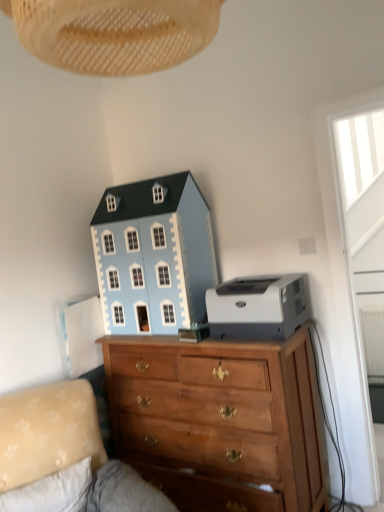
This screenshot has height=512, width=384. In order to click on velvet beige couch at lower left in this screenshot , I will do `click(64, 456)`.

Identify the location of white plastic printer at right. The width and height of the screenshot is (384, 512). (257, 307).

Describe the element at coordinates (153, 255) in the screenshot. I see `light blue painted wood dollhouse at upper center` at that location.

Locate an element on the screen. This screenshot has width=384, height=512. wooden chest of drawers at center is located at coordinates (219, 420).

Is wooden chest of drawers at center positioned far away from velvet beige couch at lower left?

No.

Between wooden chest of drawers at center and velvet beige couch at lower left, which one has less height?

Standing shorter between the two is velvet beige couch at lower left.

Considering the sizes of wooden chest of drawers at center and velvet beige couch at lower left in the image, is wooden chest of drawers at center wider or thinner than velvet beige couch at lower left?

Clearly, wooden chest of drawers at center has less width compared to velvet beige couch at lower left.

From the image's perspective, relative to velvet beige couch at lower left, is wooden chest of drawers at center above or below?

Based on their image positions, wooden chest of drawers at center is located above velvet beige couch at lower left.

Is white plastic printer at right in contact with light blue painted wood dollhouse at upper center?

No.

Does white plastic printer at right have a larger size compared to light blue painted wood dollhouse at upper center?

No.

Is white plastic printer at right in front of or behind light blue painted wood dollhouse at upper center in the image?

Visually, white plastic printer at right is located in front of light blue painted wood dollhouse at upper center.

Can you confirm if white plastic printer at right is thinner than light blue painted wood dollhouse at upper center?

In fact, white plastic printer at right might be wider than light blue painted wood dollhouse at upper center.

Does light blue painted wood dollhouse at upper center have a lesser width compared to white plastic printer at right?

Yes, light blue painted wood dollhouse at upper center is thinner than white plastic printer at right.

What's the angular difference between light blue painted wood dollhouse at upper center and white plastic printer at right's facing directions?

The facing directions of light blue painted wood dollhouse at upper center and white plastic printer at right are 0.651 degrees apart.

Does light blue painted wood dollhouse at upper center have a greater height compared to white plastic printer at right?

Indeed, light blue painted wood dollhouse at upper center has a greater height compared to white plastic printer at right.

Does point (115, 205) come closer to viewer compared to point (270, 324)?

No.

From the image's perspective, would you say light blue painted wood dollhouse at upper center is positioned over woven beige lampshade at upper center?

Incorrect, from the image's perspective, light blue painted wood dollhouse at upper center is lower than woven beige lampshade at upper center.

Considering the sizes of objects light blue painted wood dollhouse at upper center and woven beige lampshade at upper center in the image provided, who is smaller, light blue painted wood dollhouse at upper center or woven beige lampshade at upper center?

Smaller between the two is woven beige lampshade at upper center.

Consider the image. Is light blue painted wood dollhouse at upper center positioned beyond the bounds of woven beige lampshade at upper center?

Indeed, light blue painted wood dollhouse at upper center is completely outside woven beige lampshade at upper center.

Which is closer, (x=161, y=327) or (x=52, y=26)?

The point (x=52, y=26) is closer to the camera.

Considering the relative sizes of woven beige lampshade at upper center and wooden chest of drawers at center in the image provided, is woven beige lampshade at upper center thinner than wooden chest of drawers at center?

Correct, the width of woven beige lampshade at upper center is less than that of wooden chest of drawers at center.

Considering the sizes of woven beige lampshade at upper center and wooden chest of drawers at center in the image, is woven beige lampshade at upper center taller or shorter than wooden chest of drawers at center?

Considering their sizes, woven beige lampshade at upper center has less height than wooden chest of drawers at center.

You are a GUI agent. You are given a task and a screenshot of the screen. Output one action in this format:
    pyautogui.click(x=<x>, y=<y>)
    Task: Click on the lamp located above the wooden chest of drawers at center (from a real-world perspective)
    
    Given the screenshot: What is the action you would take?
    pyautogui.click(x=114, y=32)

Is woven beige lampshade at upper center smaller than wooden chest of drawers at center?

Indeed, woven beige lampshade at upper center has a smaller size compared to wooden chest of drawers at center.

Is velvet beige couch at lower left completely or partially inside light blue painted wood dollhouse at upper center?

Definitely not — velvet beige couch at lower left is not inside light blue painted wood dollhouse at upper center.

From a real-world perspective, is light blue painted wood dollhouse at upper center positioned under velvet beige couch at lower left based on gravity?

No, from a real-world perspective, light blue painted wood dollhouse at upper center is not below velvet beige couch at lower left.

Locate an element on the screen. This screenshot has height=512, width=384. toy above the velvet beige couch at lower left (from a real-world perspective) is located at coordinates (153, 255).

Does light blue painted wood dollhouse at upper center touch velvet beige couch at lower left?

light blue painted wood dollhouse at upper center is not next to velvet beige couch at lower left, and they're not touching.

I want to click on studio couch that appears on the left of woven beige lampshade at upper center, so click(x=64, y=456).

Is woven beige lampshade at upper center aimed at velvet beige couch at lower left?

No, woven beige lampshade at upper center does not turn towards velvet beige couch at lower left.

Could velvet beige couch at lower left be considered to be inside woven beige lampshade at upper center?

No, velvet beige couch at lower left is located outside of woven beige lampshade at upper center.

The image size is (384, 512). I want to click on chest of drawers on the right of velvet beige couch at lower left, so click(219, 420).

This screenshot has width=384, height=512. I want to click on printer below the light blue painted wood dollhouse at upper center (from a real-world perspective), so click(257, 307).

Based on their spatial positions, is light blue painted wood dollhouse at upper center or white plastic printer at right closer to woven beige lampshade at upper center?

white plastic printer at right is closer to woven beige lampshade at upper center.

Considering their positions, is light blue painted wood dollhouse at upper center positioned closer to white plastic printer at right than wooden chest of drawers at center?

wooden chest of drawers at center is positioned closer to the anchor white plastic printer at right.

Estimate the real-world distances between objects in this image. Which object is further from velvet beige couch at lower left, woven beige lampshade at upper center or light blue painted wood dollhouse at upper center?

woven beige lampshade at upper center.

Looking at the image, which one is located closer to light blue painted wood dollhouse at upper center, white plastic printer at right or velvet beige couch at lower left?

white plastic printer at right lies closer to light blue painted wood dollhouse at upper center than the other object.

Based on their spatial positions, is velvet beige couch at lower left or white plastic printer at right further from woven beige lampshade at upper center?

Among the two, velvet beige couch at lower left is located further to woven beige lampshade at upper center.

When comparing their distances from velvet beige couch at lower left, does woven beige lampshade at upper center or white plastic printer at right seem further?

woven beige lampshade at upper center.

In the scene shown: Which object lies further to the anchor point woven beige lampshade at upper center, wooden chest of drawers at center or white plastic printer at right?

The object further to woven beige lampshade at upper center is wooden chest of drawers at center.

Looking at the image, which one is located further to velvet beige couch at lower left, white plastic printer at right or light blue painted wood dollhouse at upper center?

white plastic printer at right is positioned further to the anchor velvet beige couch at lower left.

At what (x,y) coordinates should I click in order to perform the action: click on chest of drawers between woven beige lampshade at upper center and white plastic printer at right in the front-back direction. Please return your answer as a coordinate pair (x, y). Looking at the image, I should click on (219, 420).

Where is `chest of drawers between woven beige lampshade at upper center and velvet beige couch at lower left in the vertical direction`? chest of drawers between woven beige lampshade at upper center and velvet beige couch at lower left in the vertical direction is located at coordinates pos(219,420).

Where is `chest of drawers between velvet beige couch at lower left and white plastic printer at right along the z-axis`? Image resolution: width=384 pixels, height=512 pixels. chest of drawers between velvet beige couch at lower left and white plastic printer at right along the z-axis is located at coordinates (219, 420).

I want to click on chest of drawers between velvet beige couch at lower left and light blue painted wood dollhouse at upper center from front to back, so tap(219, 420).